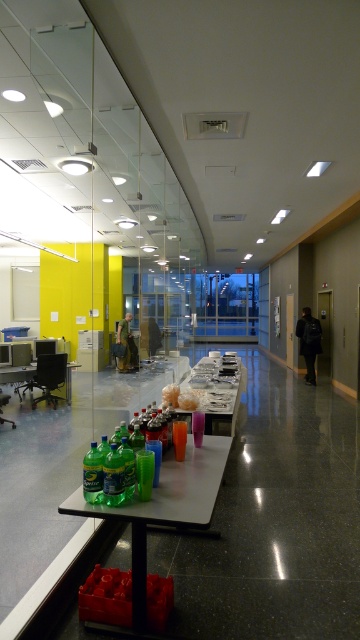
Can you confirm if white glossy table at center is shorter than green plastic table at lower left?

In fact, white glossy table at center may be taller than green plastic table at lower left.

Which is more to the left, white glossy table at center or green plastic table at lower left?

green plastic table at lower left

The image size is (360, 640). I want to click on white glossy table at center, so click(x=214, y=392).

Find the location of a particular element. white glossy table at center is located at coordinates pyautogui.click(x=214, y=392).

Between translucent plastic table at lower center and white glossy table at center, which one appears on the right side from the viewer's perspective?

From the viewer's perspective, white glossy table at center appears more on the right side.

Who is shorter, translucent plastic table at lower center or white glossy table at center?

white glossy table at center

Does point (210, 484) lie behind point (205, 360)?

No, it is in front of (205, 360).

The image size is (360, 640). Find the location of `translucent plastic table at lower center`. translucent plastic table at lower center is located at coordinates (164, 506).

Does translucent plastic table at lower center have a lesser height compared to green plastic table at lower left?

No, translucent plastic table at lower center is not shorter than green plastic table at lower left.

Who is higher up, translucent plastic table at lower center or green plastic table at lower left?

green plastic table at lower left

Describe the element at coordinates (164, 506) in the screenshot. The width and height of the screenshot is (360, 640). I see `translucent plastic table at lower center` at that location.

Identify the location of translucent plastic table at lower center. This screenshot has height=640, width=360. (164, 506).